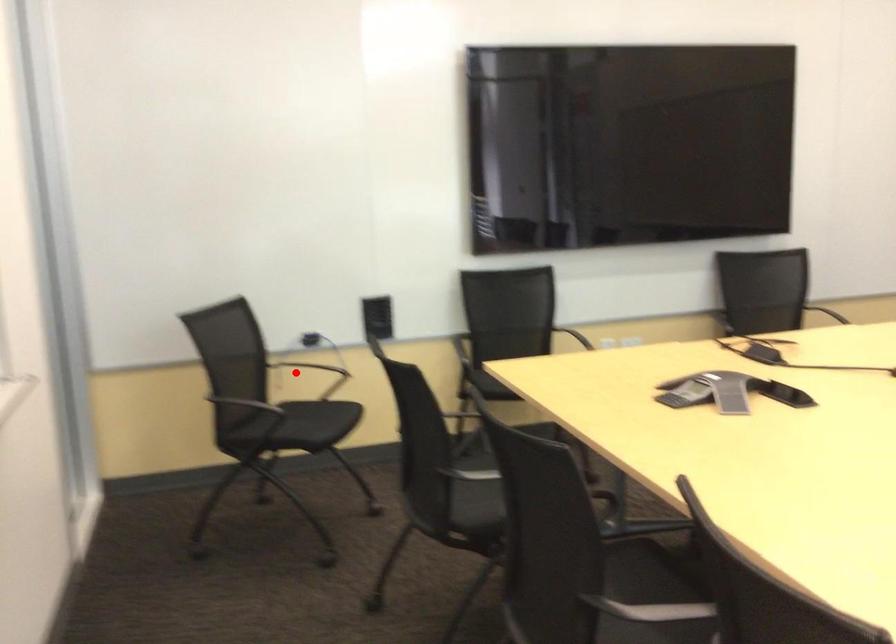
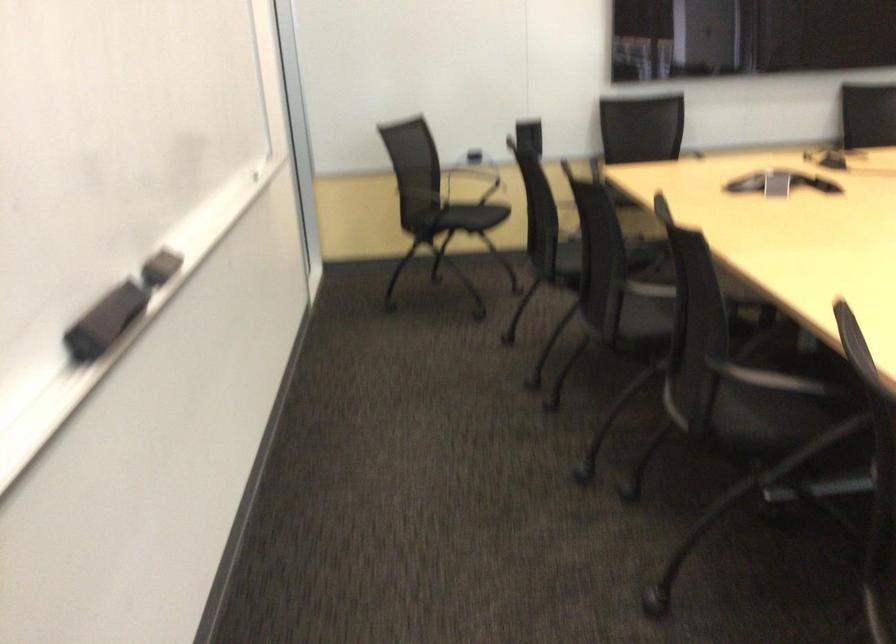
Question: I am providing you with two images of the same scene from different viewpoints. Image1 has a red point marked. In image2, the corresponding 3D location appears at what relative position? Reply with the corresponding letter.

Choices:
 (A) Closer
 (B) Farther

Answer: (B)